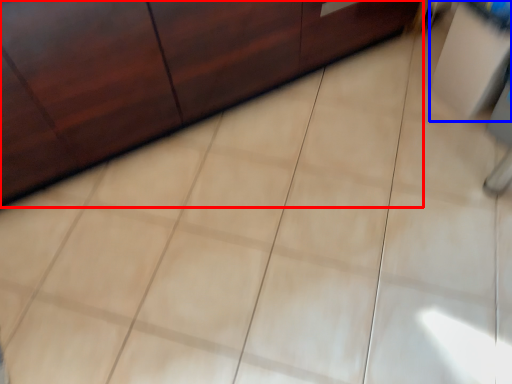
Question: Which of the following is the farthest to the observer, furniture (highlighted by a red box) or vanity (highlighted by a blue box)?

Choices:
 (A) furniture
 (B) vanity

Answer: (B)